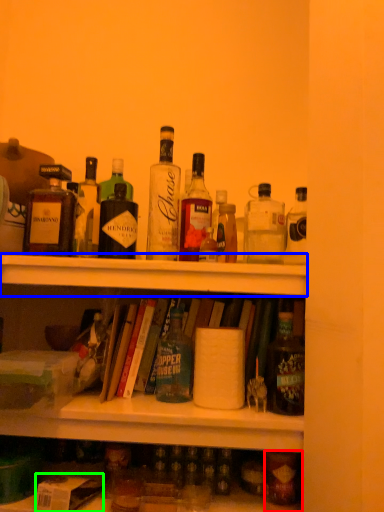
Question: Based on their relative distances, which object is farther from bottle (highlighted by a red box)? Choose from shelf (highlighted by a blue box) and box (highlighted by a green box).

Choices:
 (A) shelf
 (B) box

Answer: (A)